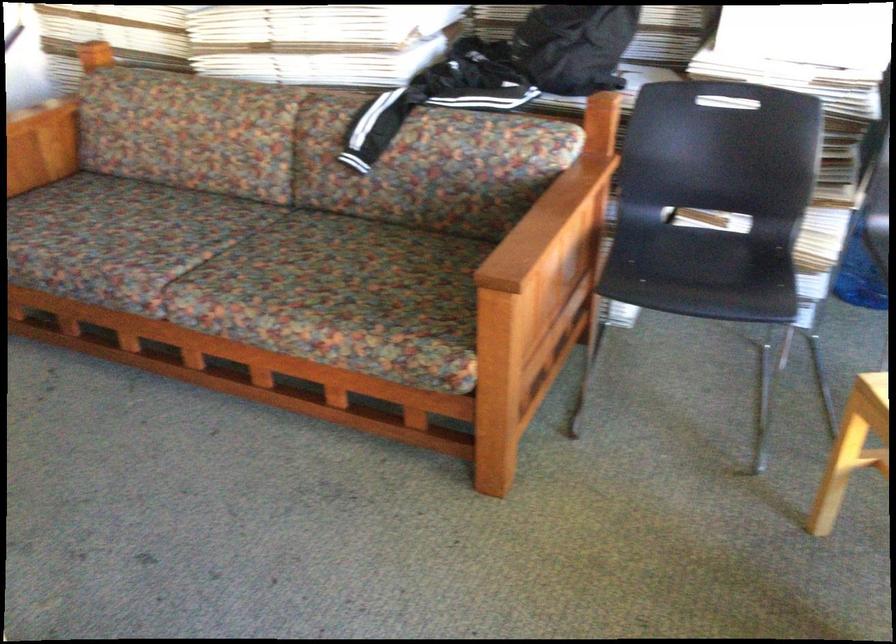
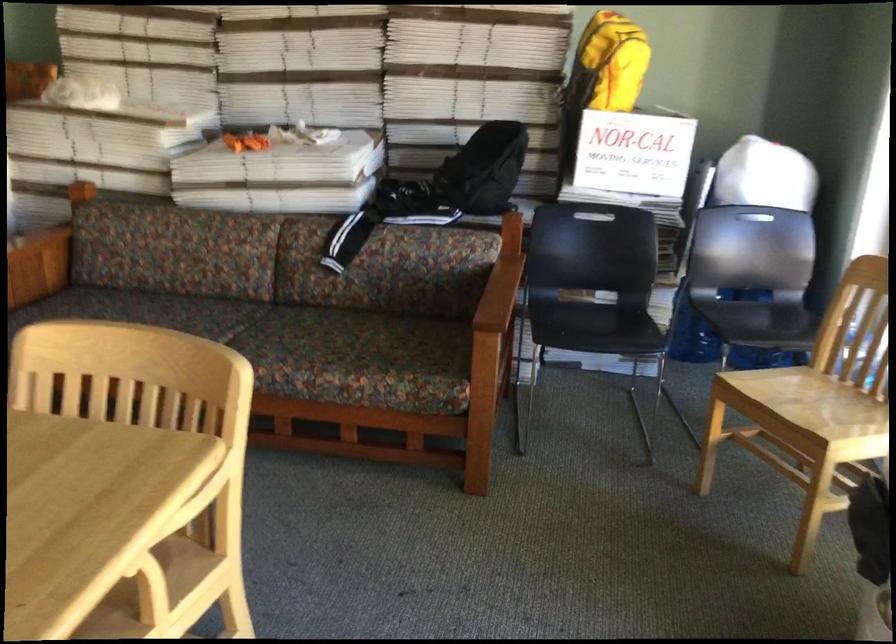
In a continuous first-person perspective shot, in which direction is the camera moving?

The cameraman moved toward left, backward.